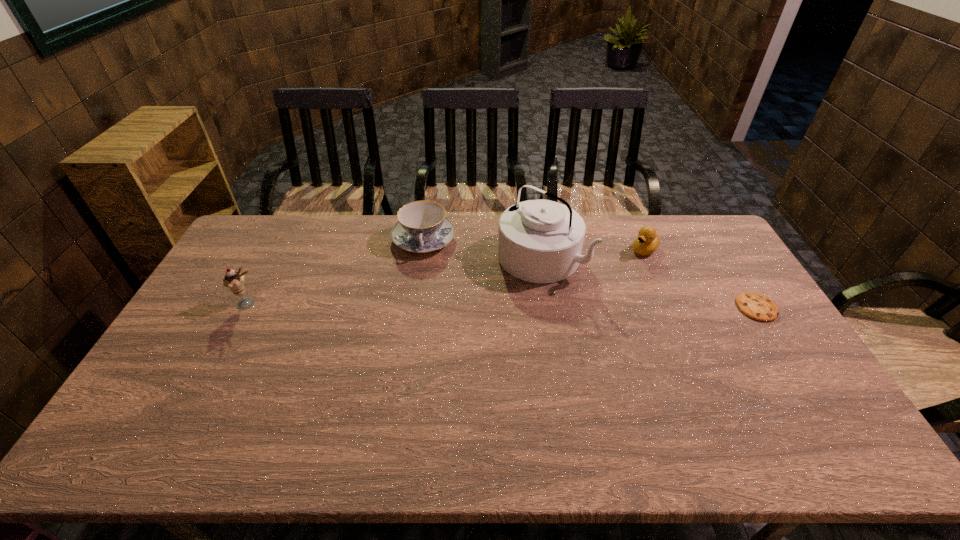
Where is `the fourth shortest object`? the fourth shortest object is located at coordinates (234, 281).

This screenshot has height=540, width=960. In order to click on icecream in this screenshot , I will do `click(234, 281)`.

You are a GUI agent. You are given a task and a screenshot of the screen. Output one action in this format:
    pyautogui.click(x=<x>, y=<y>)
    Task: Click on the shortest object
    This screenshot has height=540, width=960.
    Given the screenshot: What is the action you would take?
    pyautogui.click(x=756, y=306)

Find the location of a particular element. the rightmost object is located at coordinates click(756, 306).

Where is `the fourth object from right to left`? The height and width of the screenshot is (540, 960). the fourth object from right to left is located at coordinates (422, 227).

At what (x,y) coordinates should I click in order to perform the action: click on the fourth object from left to right. Please return your answer as a coordinate pair (x, y). The image size is (960, 540). Looking at the image, I should click on (648, 240).

Identify the location of the tallest object. This screenshot has height=540, width=960. (540, 241).

Image resolution: width=960 pixels, height=540 pixels. I want to click on kettle, so click(540, 241).

The image size is (960, 540). Identify the location of vacant space situated 0.090m on the left of the leftmost object. (206, 303).

At what (x,y) coordinates should I click in order to perform the action: click on blank space located 0.190m on the back of the shortest object. Please return your answer as a coordinate pair (x, y). Looking at the image, I should click on (725, 256).